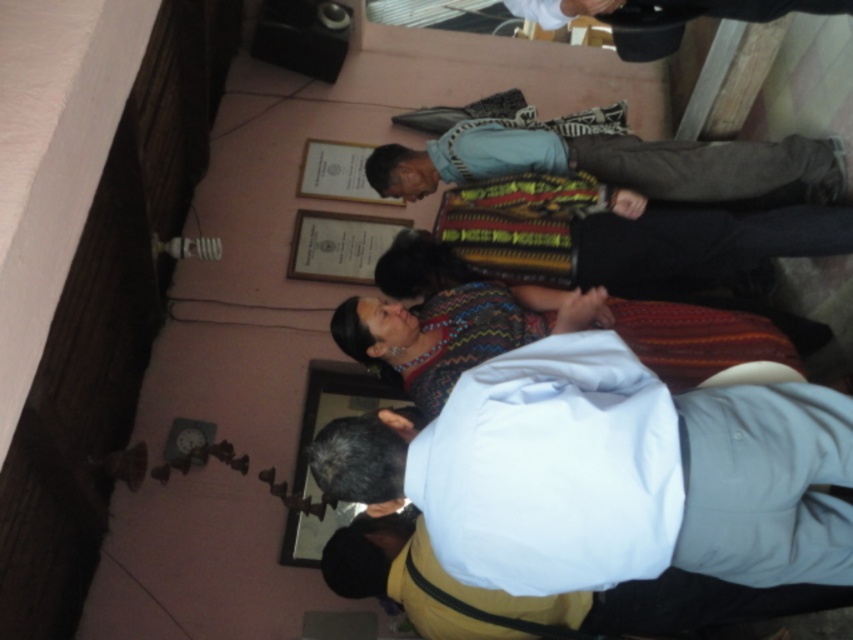
Does point (393, 406) come in front of point (357, 252)?

Yes, point (393, 406) is closer to viewer.

Between wooden frame at lower center and matte paper picture frame at center, which one has more height?

Standing taller between the two is wooden frame at lower center.

Where is `wooden frame at lower center`? wooden frame at lower center is located at coordinates (335, 406).

This screenshot has width=853, height=640. In order to click on wooden frame at lower center in this screenshot , I will do click(x=335, y=406).

Measure the distance between point (305,272) and camera.

Point (305,272) is 4.30 meters from camera.

Who is higher up, matte paper picture frame at center or matte gold frame at upper center?

matte gold frame at upper center is higher up.

Is point (326, 275) more distant than point (373, 202)?

That is False.

Locate an element on the screen. This screenshot has width=853, height=640. matte paper picture frame at center is located at coordinates (339, 244).

Between point (589, 154) and point (387, 241), which one is positioned behind?

The point (387, 241) is behind.

Is blue cotton shirt at center in front of matte paper picture frame at center?

Yes, blue cotton shirt at center is closer to the viewer.

Is point (595, 141) farther from camera compared to point (375, 230)?

That is False.

You are a GUI agent. You are given a task and a screenshot of the screen. Output one action in this format:
    pyautogui.click(x=<x>, y=<y>)
    Task: Click on the blue cotton shirt at center
    Image resolution: width=853 pixels, height=640 pixels.
    Given the screenshot: What is the action you would take?
    pyautogui.click(x=613, y=163)